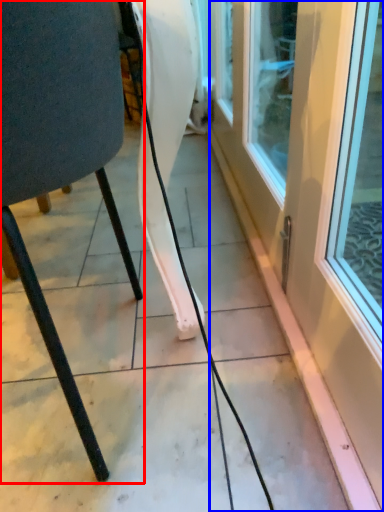
Question: Which of the following is the closest to the observer, chair (highlighted by a red box) or door (highlighted by a blue box)?

Choices:
 (A) chair
 (B) door

Answer: (B)